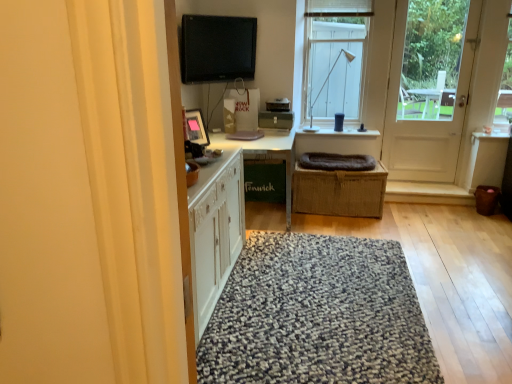
Question: Is matte black lamp at upper center to the left of white glass window at upper center from the viewer's perspective?

Choices:
 (A) no
 (B) yes

Answer: (B)

Question: Considering the relative sizes of matte black lamp at upper center and white glass window at upper center in the image provided, is matte black lamp at upper center taller than white glass window at upper center?

Choices:
 (A) no
 (B) yes

Answer: (A)

Question: Is white glass window at upper center at the back of matte black lamp at upper center?

Choices:
 (A) no
 (B) yes

Answer: (B)

Question: From a real-world perspective, is matte black lamp at upper center physically below white glass window at upper center?

Choices:
 (A) yes
 (B) no

Answer: (A)

Question: From the image's perspective, is matte black lamp at upper center under white glass window at upper center?

Choices:
 (A) no
 (B) yes

Answer: (B)

Question: Considering the relative sizes of matte black lamp at upper center and white glass window at upper center in the image provided, is matte black lamp at upper center thinner than white glass window at upper center?

Choices:
 (A) no
 (B) yes

Answer: (A)

Question: From a real-world perspective, is white glass window at upper center below black glossy computer monitor at upper center?

Choices:
 (A) yes
 (B) no

Answer: (A)

Question: Can you confirm if white glass window at upper center is positioned to the left of black glossy computer monitor at upper center?

Choices:
 (A) yes
 (B) no

Answer: (B)

Question: Is white glass window at upper center thinner than black glossy computer monitor at upper center?

Choices:
 (A) no
 (B) yes

Answer: (A)

Question: From the image's perspective, is white glass window at upper center above black glossy computer monitor at upper center?

Choices:
 (A) yes
 (B) no

Answer: (A)

Question: Is white glass window at upper center bigger than black glossy computer monitor at upper center?

Choices:
 (A) yes
 (B) no

Answer: (A)

Question: Does white glass window at upper center appear on the right side of black glossy computer monitor at upper center?

Choices:
 (A) no
 (B) yes

Answer: (B)

Question: Is black glossy computer monitor at upper center facing away from white wooden door at right?

Choices:
 (A) no
 (B) yes

Answer: (A)